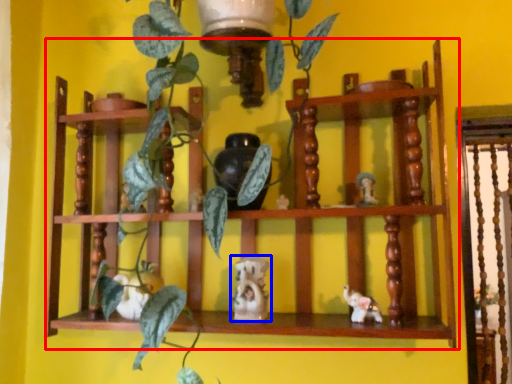
Question: Which object appears farthest to the camera in this image, shelf (highlighted by a red box) or toy (highlighted by a blue box)?

Choices:
 (A) shelf
 (B) toy

Answer: (B)